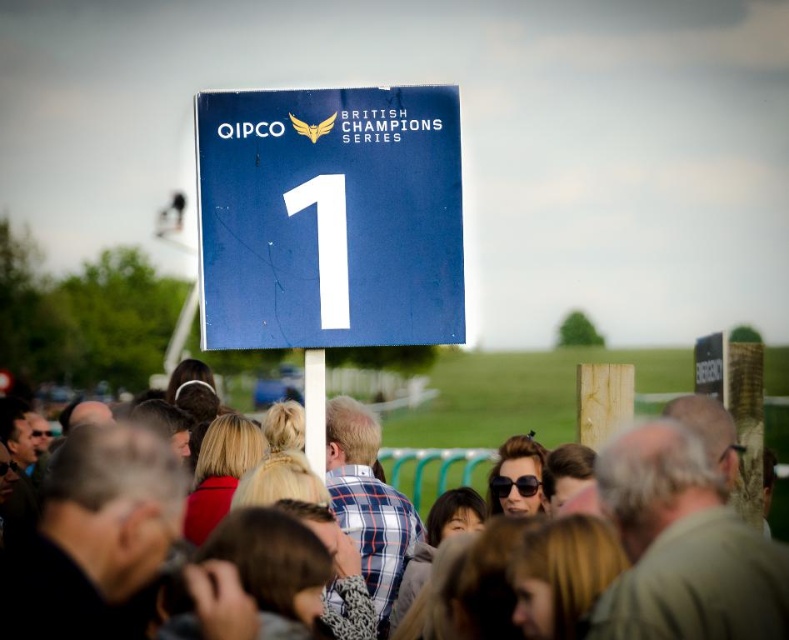
Question: Among these objects, which one is nearest to the camera?

Choices:
 (A) matte blue sign at upper center
 (B) blue matte sign at center

Answer: (B)

Question: Does blue matte sign at center have a greater width compared to matte blue sign at upper center?

Choices:
 (A) no
 (B) yes

Answer: (A)

Question: Which point is farther to the camera?

Choices:
 (A) white plastic pole at center
 (B) matte blue sign at upper center

Answer: (A)

Question: Does blue matte sign at center have a larger size compared to white plastic pole at center?

Choices:
 (A) yes
 (B) no

Answer: (B)

Question: Among these objects, which one is nearest to the camera?

Choices:
 (A) blue matte sign at center
 (B) matte blue sign at upper center

Answer: (A)

Question: Can you confirm if matte blue sign at upper center is smaller than white plastic pole at center?

Choices:
 (A) yes
 (B) no

Answer: (B)